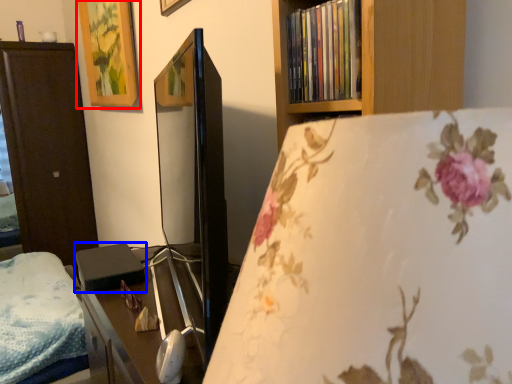
Question: Which of the following is the farthest to the observer, picture frame (highlighted by a red box) or paperback book (highlighted by a blue box)?

Choices:
 (A) picture frame
 (B) paperback book

Answer: (A)